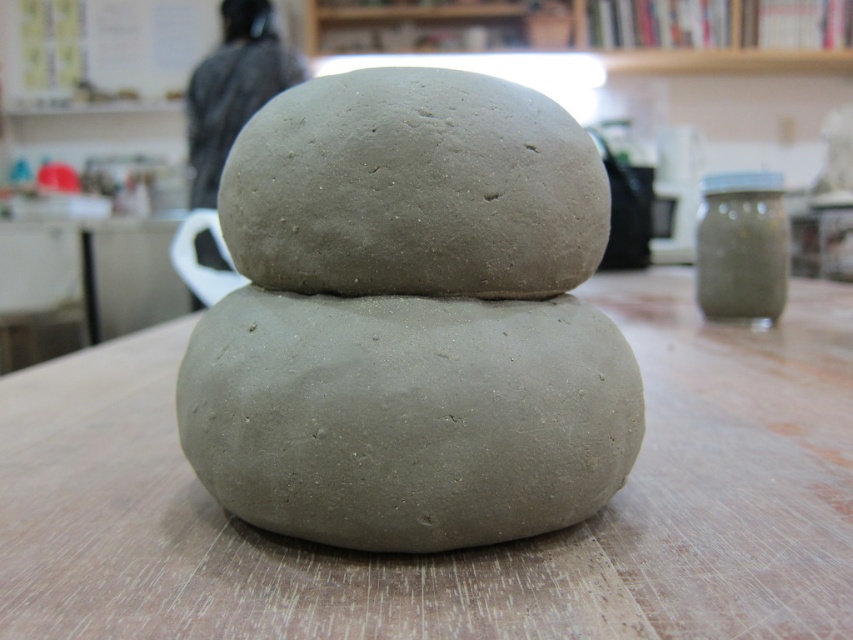
In the scene shown: Between gray matte clay at center and gray matte stone at center, which one appears on the left side from the viewer's perspective?

gray matte clay at center is more to the left.

Is gray matte clay at center above gray matte stone at center?

No.

Where is `gray matte clay at center`? Image resolution: width=853 pixels, height=640 pixels. gray matte clay at center is located at coordinates (408, 417).

Which is below, matte gray clay at center or gray matte stone at center?

matte gray clay at center is lower down.

Image resolution: width=853 pixels, height=640 pixels. What do you see at coordinates (465, 552) in the screenshot? I see `matte gray clay at center` at bounding box center [465, 552].

Is point (653, 500) positioned before point (572, 122)?

No, it is not.

The height and width of the screenshot is (640, 853). What are the coordinates of `matte gray clay at center` in the screenshot? It's located at coord(465,552).

Is matte gray clay at center thinner than gray matte clay at center?

No.

Who is higher up, matte gray clay at center or gray matte clay at center?

Positioned higher is matte gray clay at center.

Measure the distance between matte gray clay at center and camera.

They are 22.43 inches apart.

Locate an element on the screen. This screenshot has height=640, width=853. matte gray clay at center is located at coordinates (465, 552).